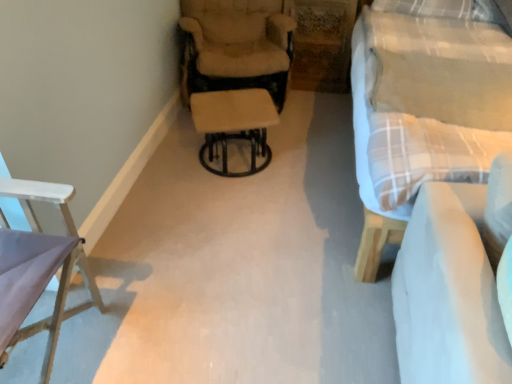
Identify the location of free space to the left of black metal stool at center. (176, 168).